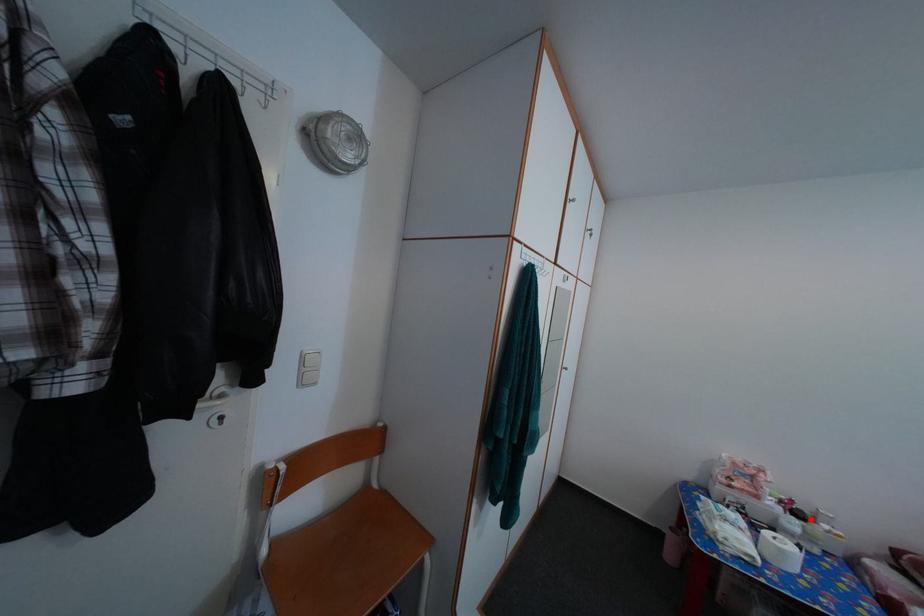
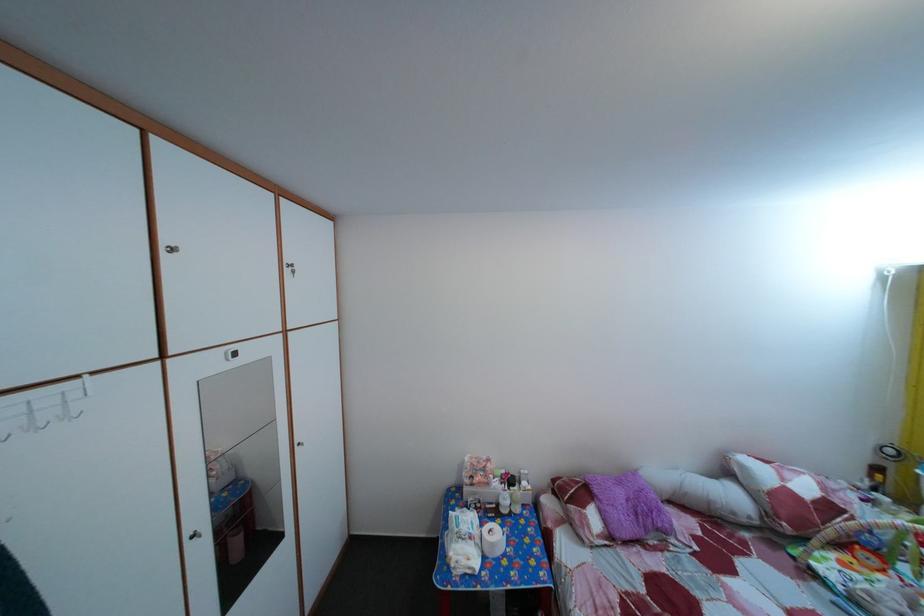
Find the pixel in the second image that matches the highlighted location in the first image.

(524, 485)